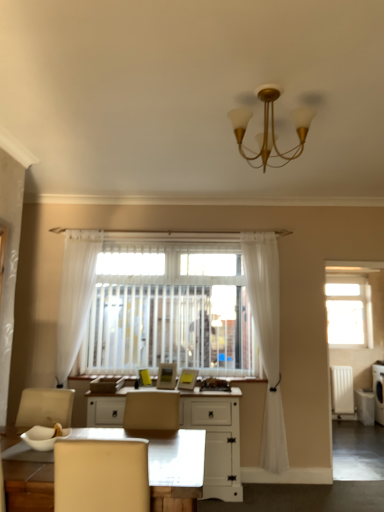
Question: From their relative heights in the image, would you say white sheer curtain at center, the first curtain when ordered from right to left, is taller or shorter than transparent glass window at upper right?

Choices:
 (A) short
 (B) tall

Answer: (B)

Question: From the image's perspective, relative to transparent glass window at upper right, is white sheer curtain at center, the first curtain when ordered from right to left, above or below?

Choices:
 (A) below
 (B) above

Answer: (B)

Question: Based on their relative distances, which object is farther from the gold metallic chandelier at upper center?

Choices:
 (A) white sheer curtain at left, the second curtain positioned from the right
 (B) matte yellow picture frame at center, which is the first picture frame from right to left
 (C) transparent glass window at upper right
 (D) white plastic radiator at right
 (E) matte yellow picture frame at center, marked as the 1th picture frame in a left-to-right arrangement

Answer: (D)

Question: Estimate the real-world distances between objects in this image. Which object is closer to the white painted wood desk at center?

Choices:
 (A) matte yellow picture frame at center, which is the first picture frame from right to left
 (B) white plastic radiator at right
 (C) transparent glass window at upper right
 (D) gold metallic chandelier at upper center
 (E) matte yellow picture frame at center, marked as the 1th picture frame in a left-to-right arrangement

Answer: (A)